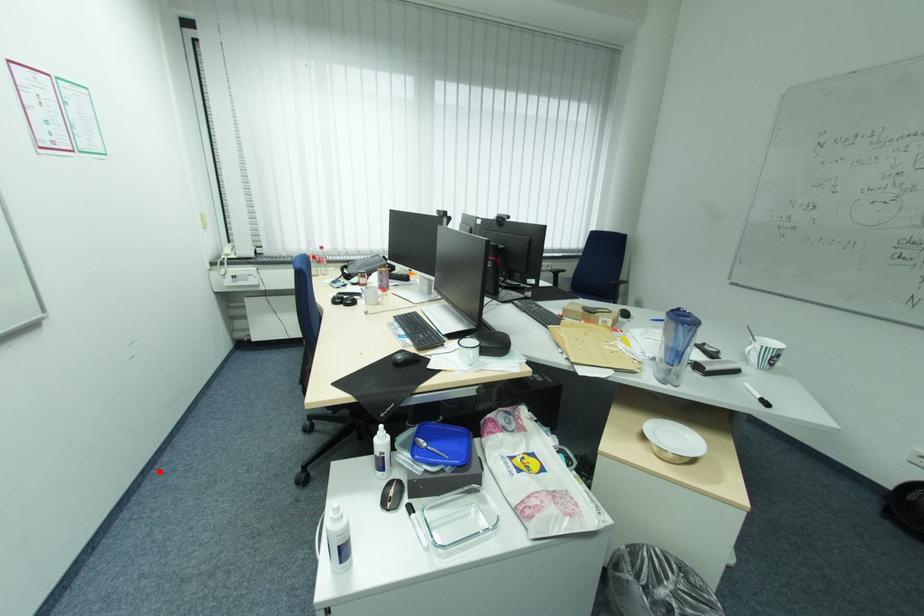
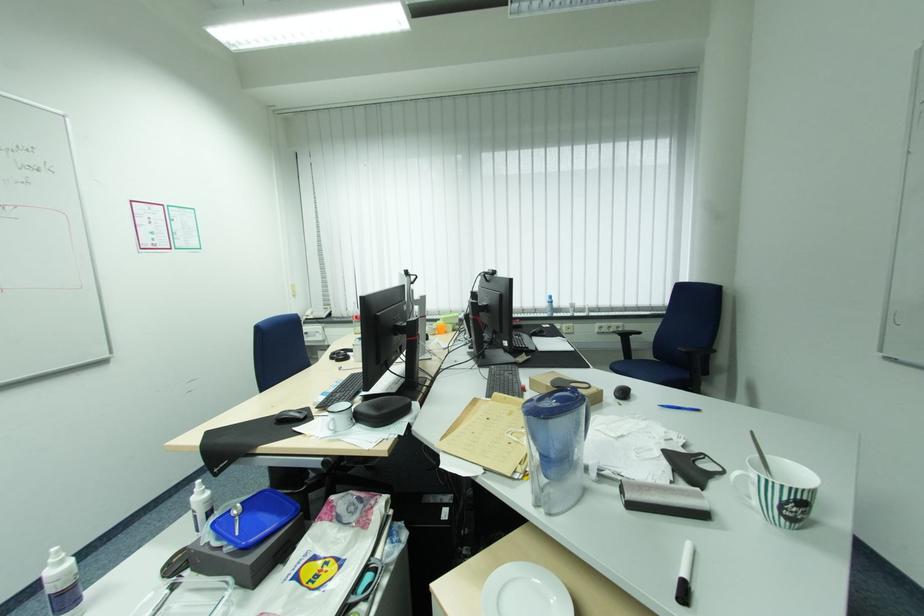
Locate, in the second image, the point that corresponds to the highlighted location in the first image.

(193, 487)